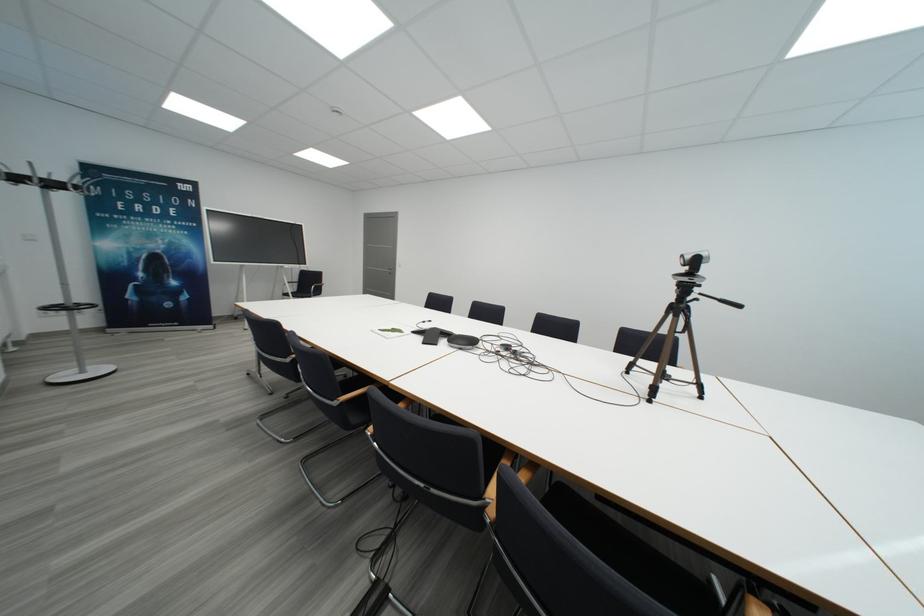
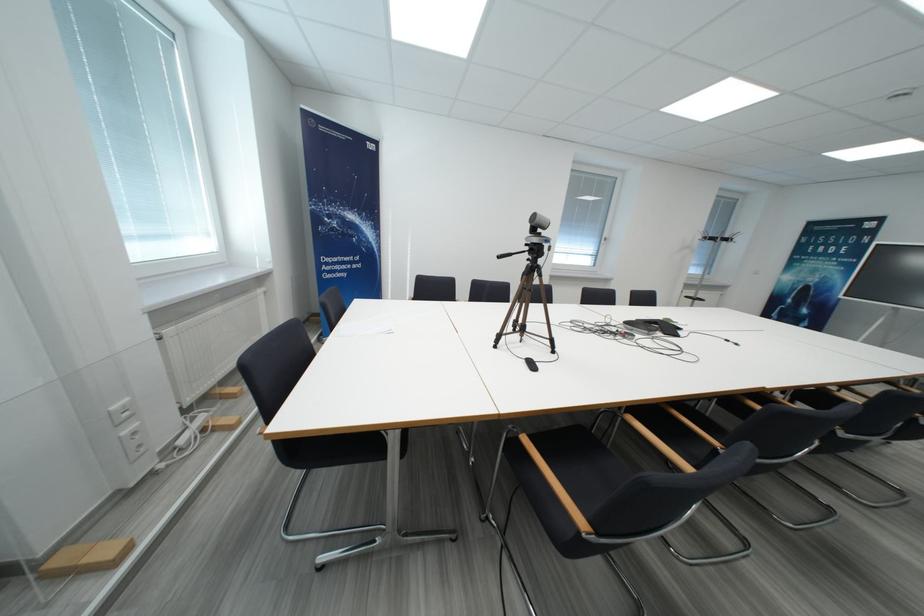
In the second image, find the point that corresponds to point 708,297 in the first image.

(531, 254)